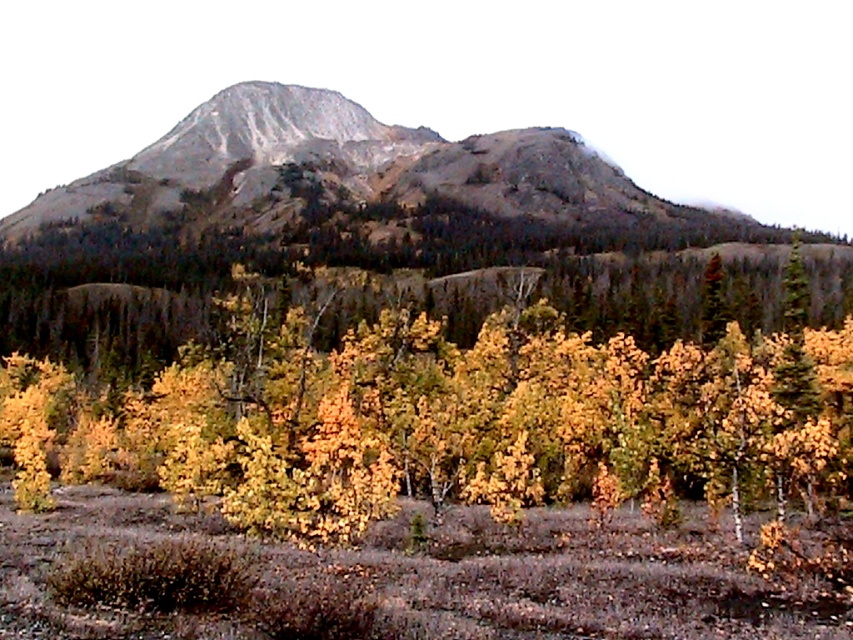
Question: Which of the following is the closest to the observer?

Choices:
 (A) yellow matte tree at center
 (B) gray rock mountain at center

Answer: (A)

Question: Can you confirm if yellow matte tree at center is positioned below gray rock mountain at center?

Choices:
 (A) yes
 (B) no

Answer: (A)

Question: Does yellow matte tree at center have a larger size compared to gray rock mountain at center?

Choices:
 (A) no
 (B) yes

Answer: (A)

Question: Which of the following is the farthest from the observer?

Choices:
 (A) yellow matte tree at center
 (B) gray rock mountain at center

Answer: (B)

Question: Is yellow matte tree at center in front of gray rock mountain at center?

Choices:
 (A) no
 (B) yes

Answer: (B)

Question: Which object appears farthest from the camera in this image?

Choices:
 (A) gray rock mountain at center
 (B) yellow matte tree at center

Answer: (A)